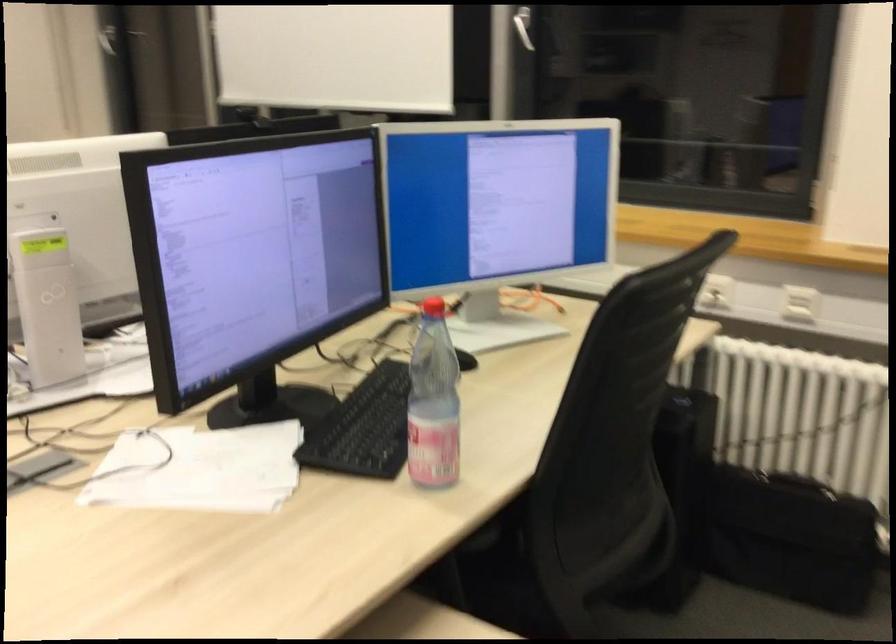
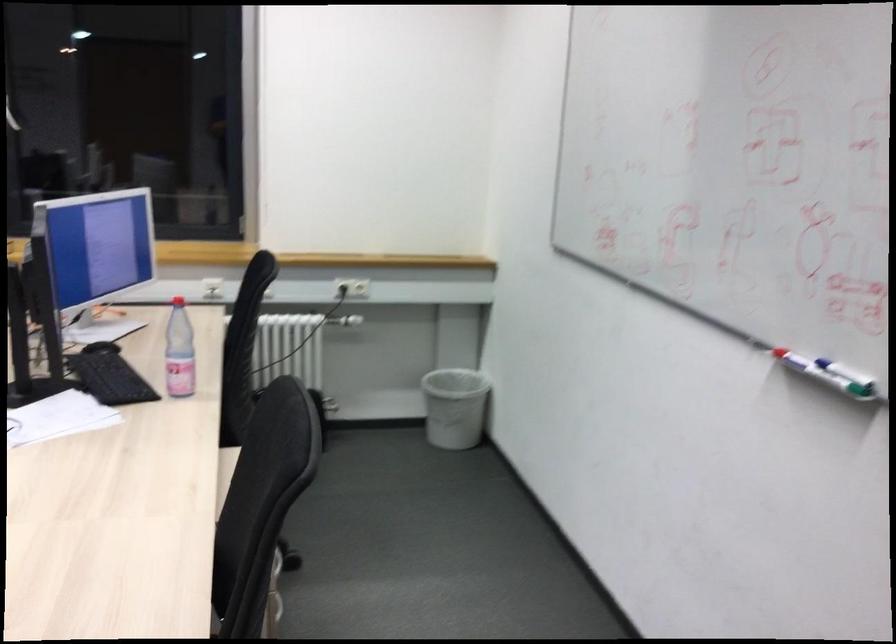
Question: I am providing you with two images of the same scene from different viewpoints. After the viewpoint changes to image2, which objects are now occluded?

Choices:
 (A) chair sitting surface
 (B) snow globe
 (C) black chair sitting surface
 (D) plastic water bottle

Answer: (A)